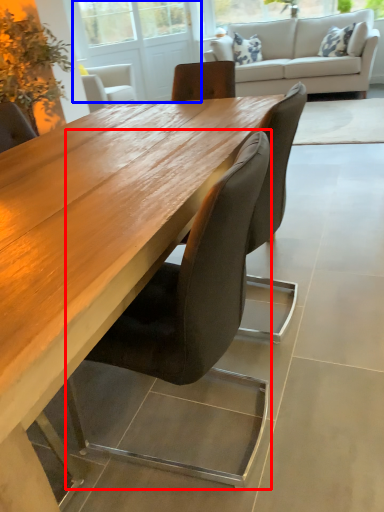
Question: Which object is further to the camera taking this photo, chair (highlighted by a red box) or screen door (highlighted by a blue box)?

Choices:
 (A) chair
 (B) screen door

Answer: (B)